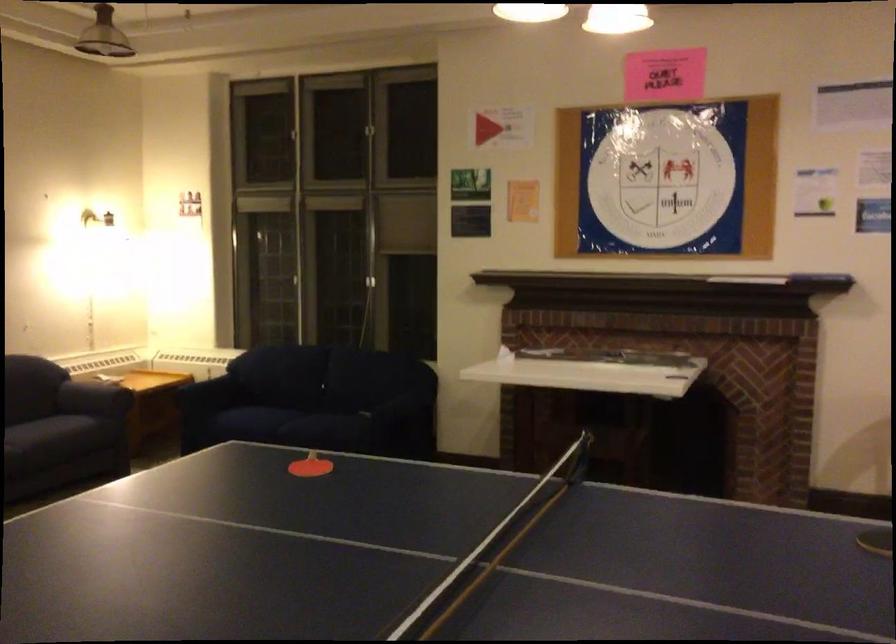
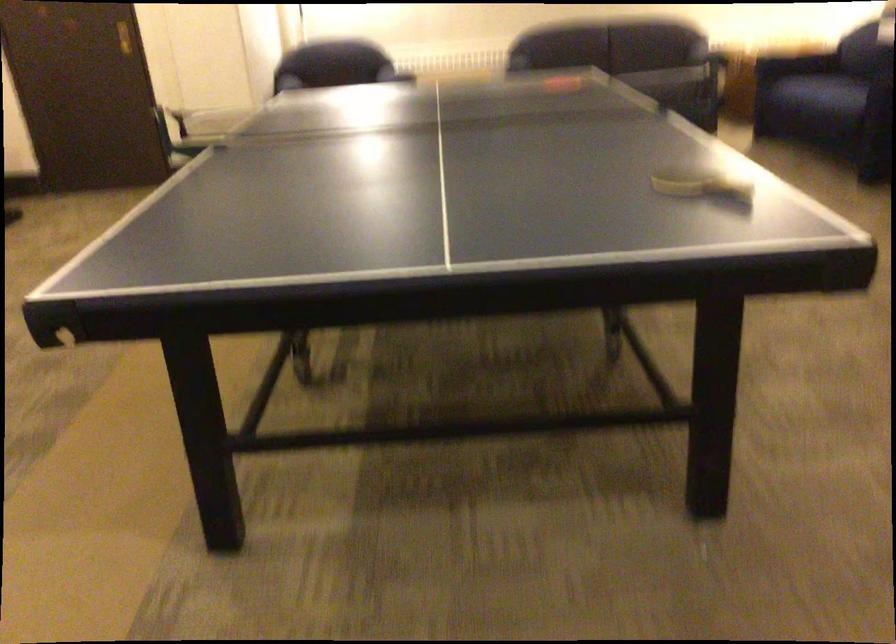
Locate, in the second image, the point that corresponds to (354,444) in the first image.

(819, 105)